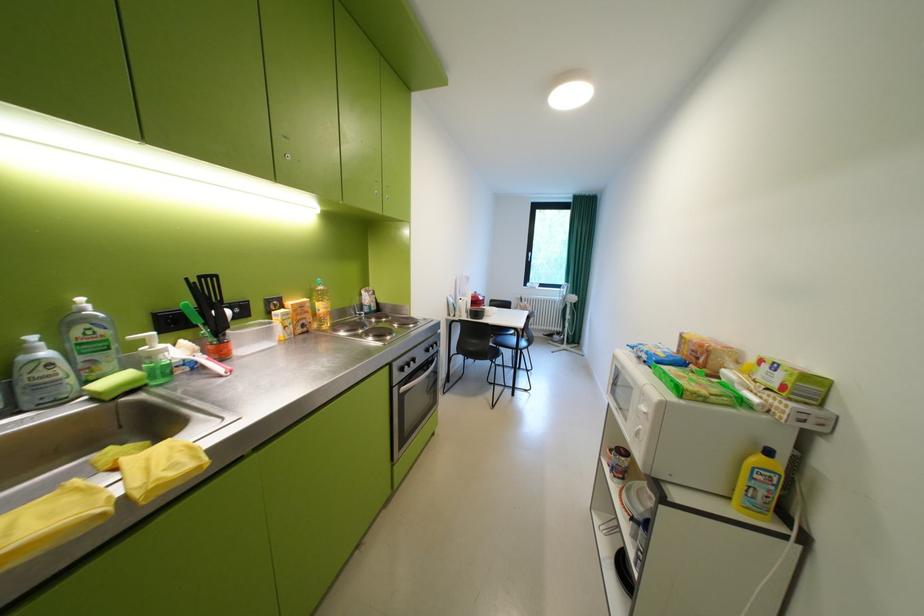
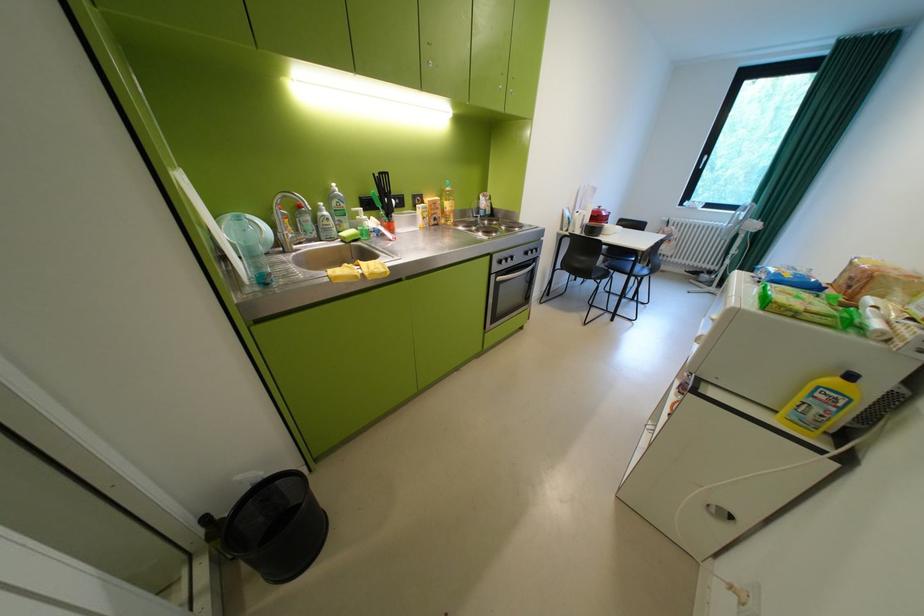
In the second image, find the point that corresponds to point 62,365 in the first image.

(338, 220)